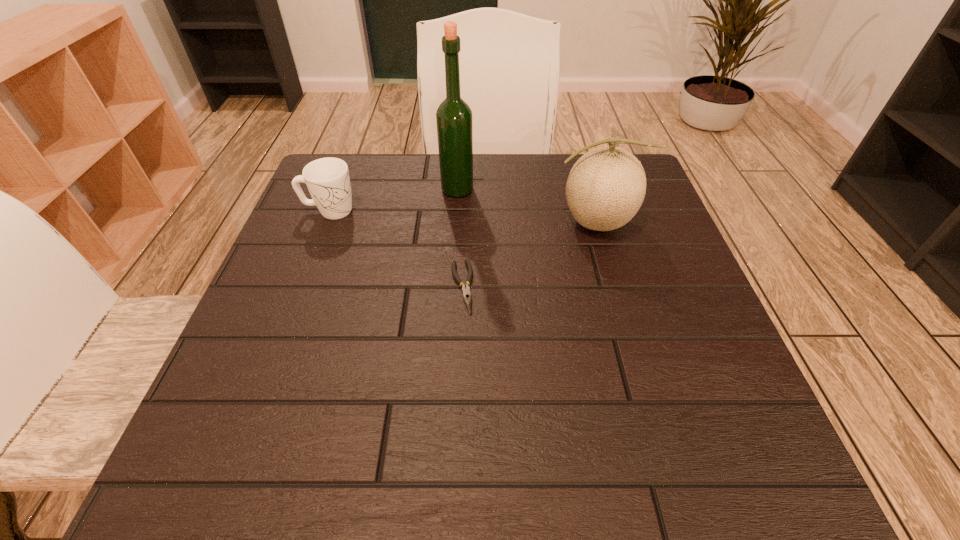
Image resolution: width=960 pixels, height=540 pixels. I want to click on free space between the second shortest object and the liquor, so click(x=394, y=200).

Identify the location of unoccupied area between the tallest object and the second shortest object. (394, 200).

This screenshot has width=960, height=540. Identify the location of vacant region between the nearest object and the tallest object. (460, 238).

The image size is (960, 540). I want to click on object that is the second closest to the shortest object, so click(454, 121).

Locate which object is the closest to the liquor. Please provide its 2D coordinates. Your answer should be formatted as a tuple, i.e. [(x, y)], where the tuple contains the x and y coordinates of a point satisfying the conditions above.

[(606, 187)]

What are the coordinates of `free space that satisfies the following two spatial constraints: 1. on the side of the second tallest object with the handle; 2. on the right side of the mug` in the screenshot? It's located at (325, 222).

I want to click on vacant region that satisfies the following two spatial constraints: 1. on the side of the mug with the handle; 2. on the left side of the shortest object, so click(x=300, y=287).

This screenshot has width=960, height=540. Find the location of `free space that satisfies the following two spatial constraints: 1. on the front side of the tallest object; 2. on the side of the leftmost object with the handle`. free space that satisfies the following two spatial constraints: 1. on the front side of the tallest object; 2. on the side of the leftmost object with the handle is located at coordinates (456, 211).

Identify the location of free space that satisfies the following two spatial constraints: 1. on the side of the second shortest object with the handle; 2. on the back side of the rightmost object. The image size is (960, 540). (325, 222).